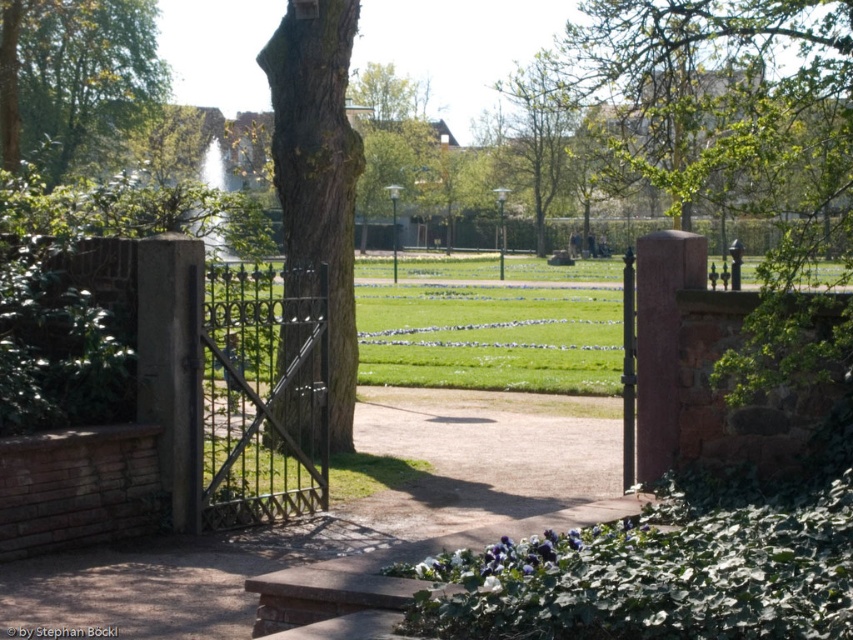
Measure the distance from brown stone path at center to smooth bark tree at center.

brown stone path at center is 7.63 feet from smooth bark tree at center.

Can you confirm if brown stone path at center is taller than smooth bark tree at center?

No.

Measure the distance between brown stone path at center and camera.

brown stone path at center is 6.78 meters from camera.

The height and width of the screenshot is (640, 853). What are the coordinates of `brown stone path at center` in the screenshot? It's located at (340, 513).

What are the coordinates of `dark brown wrought iron gate at center` in the screenshot? It's located at (264, 394).

Between point (270, 371) and point (291, 108), which one is positioned in front?

Positioned in front is point (270, 371).

The width and height of the screenshot is (853, 640). What do you see at coordinates (264, 394) in the screenshot? I see `dark brown wrought iron gate at center` at bounding box center [264, 394].

Find the location of a particular element. This screenshot has width=853, height=640. dark brown wrought iron gate at center is located at coordinates (264, 394).

Between brown stone path at center and dark brown wrought iron gate at center, which one is positioned higher?

Positioned higher is dark brown wrought iron gate at center.

Locate an element on the screen. brown stone path at center is located at coordinates tap(340, 513).

The width and height of the screenshot is (853, 640). I want to click on brown stone path at center, so click(x=340, y=513).

Find the location of a particular element. The height and width of the screenshot is (640, 853). brown stone path at center is located at coordinates (340, 513).